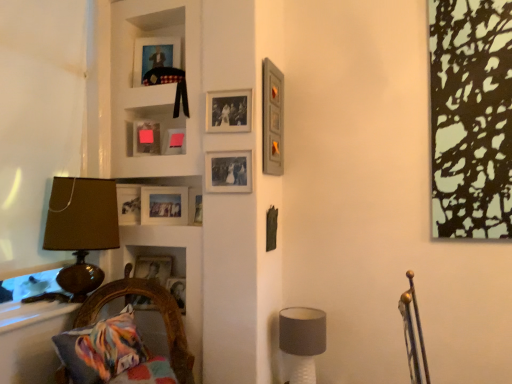
Question: Which direction should I rotate to look at matte glass picture frame at center, placed as the seventh picture frame when sorted from top to bottom, — up or down?

Choices:
 (A) up
 (B) down

Answer: (B)

Question: Which direction should I rotate to face matte plastic picture frame at upper center, which is counted as the 5th picture frame, starting from the bottom, — up or down?

Choices:
 (A) up
 (B) down

Answer: (A)

Question: From a real-world perspective, is matte plastic picture frame at upper center, which is the fourth picture frame in top-to-bottom order, physically below pink matte picture frame at upper center, the 4th picture frame positioned from the bottom?

Choices:
 (A) yes
 (B) no

Answer: (B)

Question: Does matte plastic picture frame at upper center, which is counted as the 5th picture frame, starting from the bottom, appear on the left side of pink matte picture frame at upper center, the fifth picture frame when ordered from top to bottom?

Choices:
 (A) yes
 (B) no

Answer: (A)

Question: Are matte plastic picture frame at upper center, which is the fourth picture frame in top-to-bottom order, and pink matte picture frame at upper center, the 4th picture frame positioned from the bottom, far apart?

Choices:
 (A) yes
 (B) no

Answer: (B)

Question: Is matte plastic picture frame at upper center, which is counted as the 5th picture frame, starting from the bottom, behind pink matte picture frame at upper center, the fifth picture frame when ordered from top to bottom?

Choices:
 (A) yes
 (B) no

Answer: (A)

Question: Does matte plastic picture frame at upper center, which is the fourth picture frame in top-to-bottom order, have a lesser width compared to pink matte picture frame at upper center, the fifth picture frame when ordered from top to bottom?

Choices:
 (A) no
 (B) yes

Answer: (B)

Question: From a real-world perspective, is matte plastic picture frame at upper center, which is the fourth picture frame in top-to-bottom order, positioned over pink matte picture frame at upper center, the 4th picture frame positioned from the bottom, based on gravity?

Choices:
 (A) no
 (B) yes

Answer: (B)

Question: Is matte glass picture frame at upper center, the seventh picture frame positioned from the bottom, at the right side of matte glass picture frame at center, placed as the seventh picture frame when sorted from top to bottom?

Choices:
 (A) no
 (B) yes

Answer: (B)

Question: Does matte glass picture frame at upper center, the seventh picture frame positioned from the bottom, have a lesser width compared to matte glass picture frame at center, marked as the second picture frame in a bottom-to-top arrangement?

Choices:
 (A) no
 (B) yes

Answer: (B)

Question: Can you confirm if matte glass picture frame at upper center, the second picture frame positioned from the top, is smaller than matte glass picture frame at center, placed as the seventh picture frame when sorted from top to bottom?

Choices:
 (A) no
 (B) yes

Answer: (B)

Question: Considering the relative positions of matte glass picture frame at upper center, the second picture frame positioned from the top, and matte glass picture frame at center, marked as the second picture frame in a bottom-to-top arrangement, in the image provided, is matte glass picture frame at upper center, the second picture frame positioned from the top, to the left of matte glass picture frame at center, marked as the second picture frame in a bottom-to-top arrangement, from the viewer's perspective?

Choices:
 (A) yes
 (B) no

Answer: (B)

Question: Is matte glass picture frame at upper center, the second picture frame positioned from the top, taller than matte glass picture frame at center, placed as the seventh picture frame when sorted from top to bottom?

Choices:
 (A) yes
 (B) no

Answer: (A)

Question: Would you consider matte glass picture frame at upper center, the seventh picture frame positioned from the bottom, to be distant from matte glass picture frame at center, placed as the seventh picture frame when sorted from top to bottom?

Choices:
 (A) yes
 (B) no

Answer: (B)

Question: Can you confirm if pink matte picture frame at upper center, the 4th picture frame positioned from the bottom, is positioned to the left of matte gray picture frame at upper right, the sixth picture frame from the bottom?

Choices:
 (A) yes
 (B) no

Answer: (A)